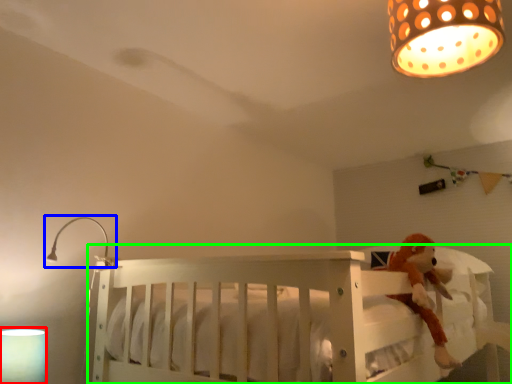
Question: Estimate the real-world distances between objects in this image. Which object is farther from lamp (highlighted by a red box), lamp (highlighted by a blue box) or infant bed (highlighted by a green box)?

Choices:
 (A) lamp
 (B) infant bed

Answer: (B)